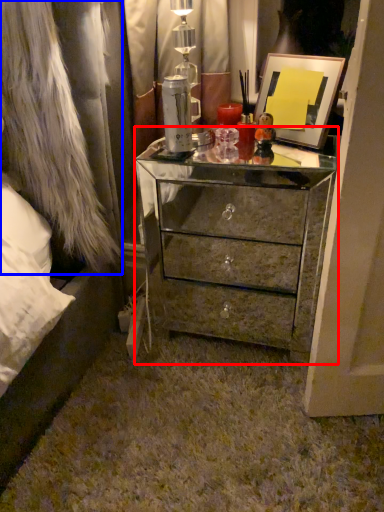
Question: Which point is further to the camera, chest of drawers (highlighted by a red box) or fur coat (highlighted by a blue box)?

Choices:
 (A) chest of drawers
 (B) fur coat

Answer: (A)